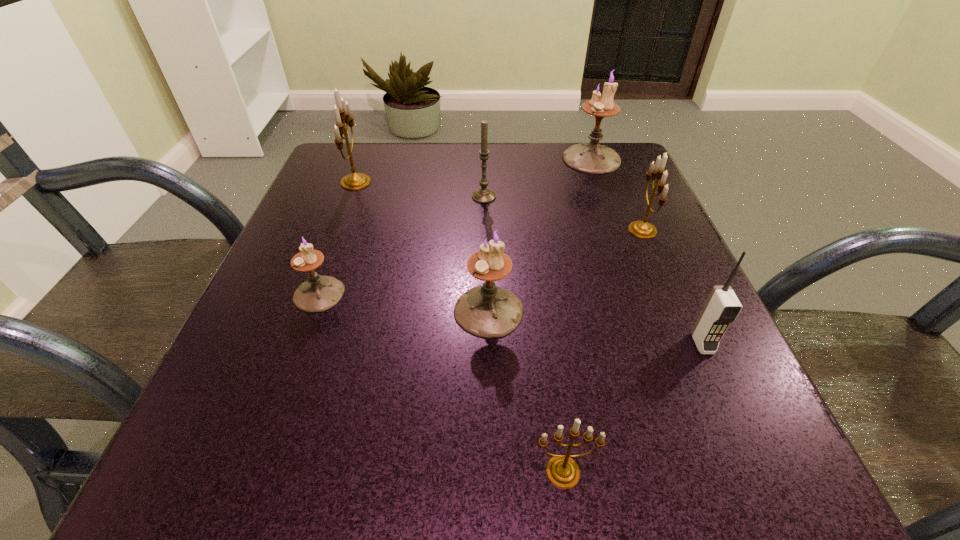
The height and width of the screenshot is (540, 960). What are the coordinates of `empty space between the smallest gold candelabrum and the gray candle` in the screenshot? It's located at (523, 334).

This screenshot has height=540, width=960. I want to click on the sixth closest object to the biggest purple candle holder, so click(x=319, y=293).

Locate which object ranks sixth in proximity to the second smallest purple candle holder. Please provide its 2D coordinates. Your answer should be formatted as a tuple, i.e. [(x, y)], where the tuple contains the x and y coordinates of a point satisfying the conditions above.

[(355, 181)]

Choose which candelabrum is the nearest neighbor to the candle. Please provide its 2D coordinates. Your answer should be formatted as a tuple, i.e. [(x, y)], where the tuple contains the x and y coordinates of a point satisfying the conditions above.

[(591, 157)]

Locate which candelabrum is the second closest to the candle. Please provide its 2D coordinates. Your answer should be formatted as a tuple, i.e. [(x, y)], where the tuple contains the x and y coordinates of a point satisfying the conditions above.

[(355, 181)]

Select which purple candle holder is the third closest to the nearest gold candelabrum. Please provide its 2D coordinates. Your answer should be formatted as a tuple, i.e. [(x, y)], where the tuple contains the x and y coordinates of a point satisfying the conditions above.

[(591, 157)]

Where is `the closest purple candle holder to the second biggest purple candle holder`? The width and height of the screenshot is (960, 540). the closest purple candle holder to the second biggest purple candle holder is located at coordinates (319, 293).

Where is `gold candelabrum that is the closest one to the rightmost purple candle holder`? gold candelabrum that is the closest one to the rightmost purple candle holder is located at coordinates (642, 229).

Locate an element on the screen. This screenshot has height=540, width=960. gold candelabrum object that ranks as the second closest to the biggest gold candelabrum is located at coordinates [x=562, y=471].

The width and height of the screenshot is (960, 540). In order to click on free space that satisfies the following two spatial constraints: 1. on the front side of the second biggest purple candle holder; 2. on the right side of the leftmost purple candle holder in this screenshot , I will do `click(313, 310)`.